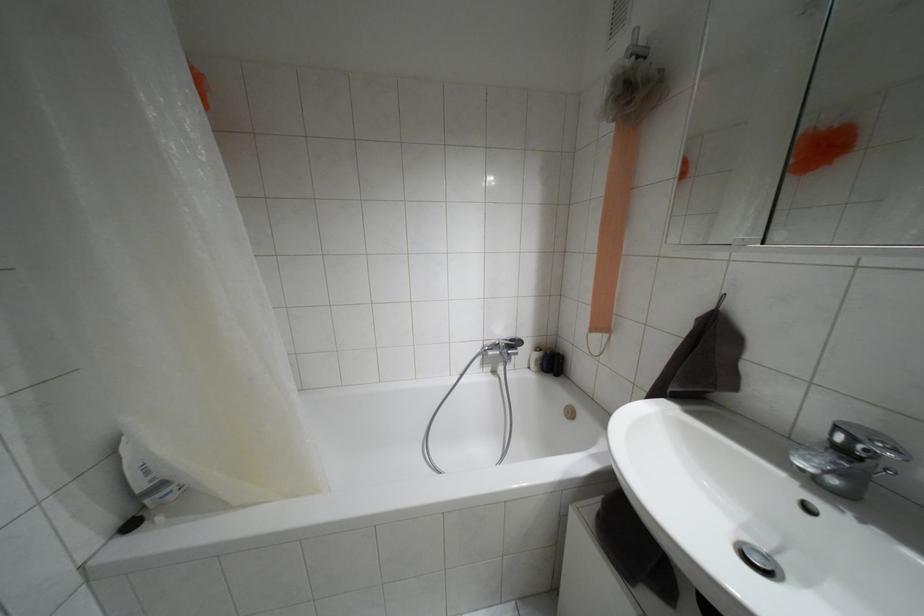
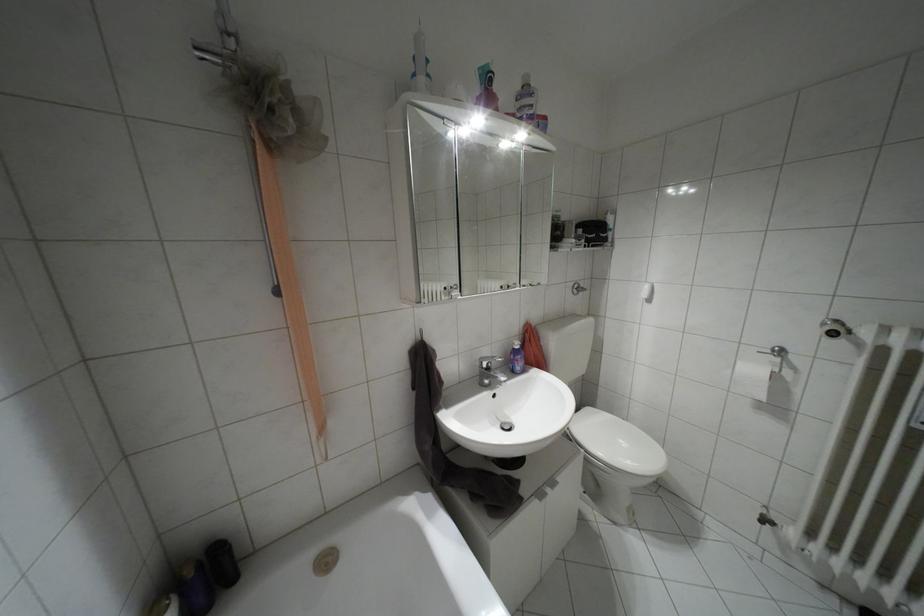
Based on the continuous images, in which direction is the camera rotating?

The rotation direction of the camera is right-down.